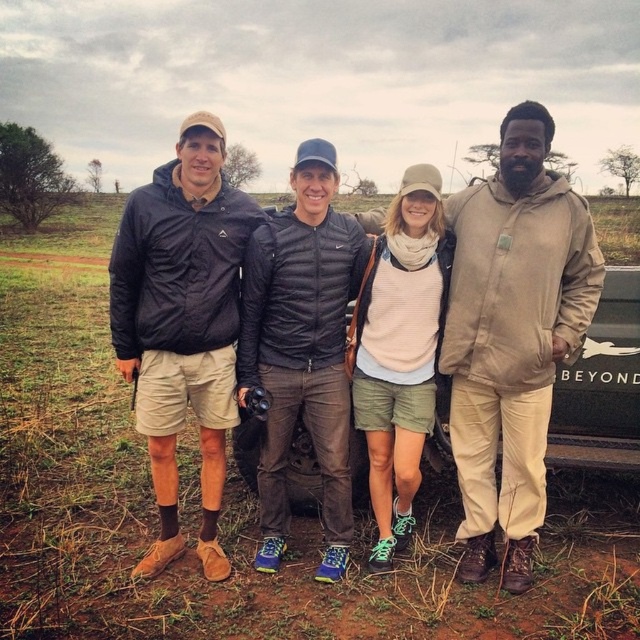
Which is above, tan fabric jacket at right or light pink sweater at center?

tan fabric jacket at right is above.

Between tan fabric jacket at right and light pink sweater at center, which one is positioned lower?

light pink sweater at center is lower down.

The image size is (640, 640). Describe the element at coordinates (513, 337) in the screenshot. I see `tan fabric jacket at right` at that location.

Where is `tan fabric jacket at right`? This screenshot has height=640, width=640. tan fabric jacket at right is located at coordinates (513, 337).

Consider the image. Which of these two, black matte jacket at left or black quilted jacket at center, stands taller?

black quilted jacket at center

Who is more forward, (224, 563) or (280, 211)?

Point (224, 563) is more forward.

Locate an element on the screen. This screenshot has height=640, width=640. black matte jacket at left is located at coordinates (182, 323).

Does point (602, 269) lie behind point (310, 212)?

That is False.

Between matte black jacket at center and black quilted jacket at center, which one appears on the right side from the viewer's perspective?

matte black jacket at center is more to the right.

You are a GUI agent. You are given a task and a screenshot of the screen. Output one action in this format:
    pyautogui.click(x=<x>, y=<y>)
    Task: Click on the matte black jacket at center
    The image size is (640, 640).
    Given the screenshot: What is the action you would take?
    pyautogui.click(x=513, y=336)